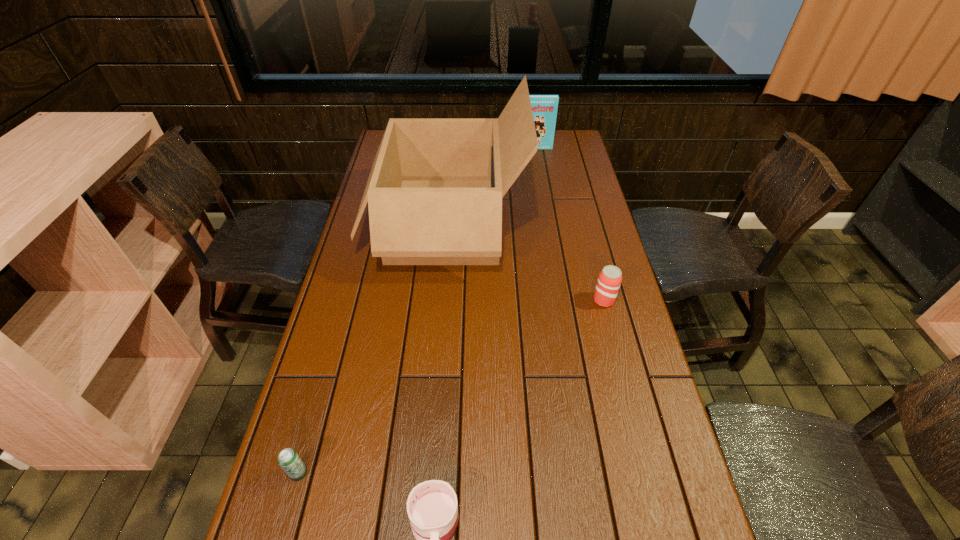
Image resolution: width=960 pixels, height=540 pixels. What are the coordinates of `the second farthest object` in the screenshot? It's located at (435, 189).

In order to click on the tallest object in this screenshot , I will do `click(435, 189)`.

Where is `the farthest object`? the farthest object is located at coordinates (544, 107).

The height and width of the screenshot is (540, 960). What are the coordinates of `the second object from right to left` in the screenshot? It's located at (544, 107).

Locate an element on the screen. the rightmost object is located at coordinates (610, 278).

Identify the location of the farther beer can. (610, 278).

The image size is (960, 540). In order to click on the nearer beer can in this screenshot , I will do click(288, 459).

Identify the location of the left beer can. (288, 459).

This screenshot has height=540, width=960. What are the coordinates of `free space located 0.140m on the right of the box` in the screenshot? It's located at (563, 222).

The width and height of the screenshot is (960, 540). I want to click on blank area located on the front cover of the fourth shortest object, so click(537, 163).